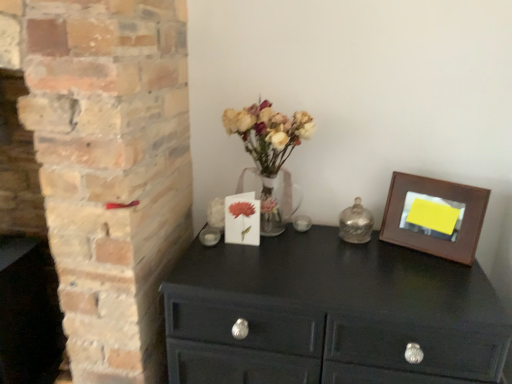
Where is `vacant space in front of translucent glass vase at center`? vacant space in front of translucent glass vase at center is located at coordinates (267, 270).